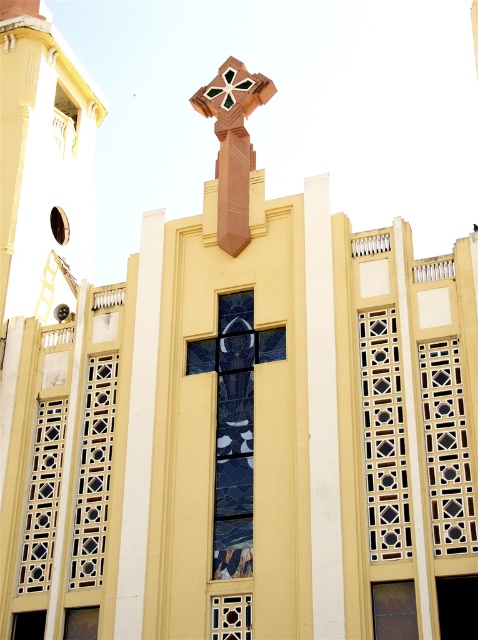
Question: Does stained glass window at center appear on the right side of matte brown window at lower left?

Choices:
 (A) no
 (B) yes

Answer: (B)

Question: Is translucent glass window at left positioned in front of matte white window at upper left?

Choices:
 (A) no
 (B) yes

Answer: (B)

Question: Which point appears closest to the camera in this image?

Choices:
 (A) (67, 269)
 (B) (228, 90)
 (C) (441, 508)
 (D) (22, 580)

Answer: (C)

Question: Can you confirm if translucent glass lattice at left is positioned to the right of matte brown window at lower left?

Choices:
 (A) yes
 (B) no

Answer: (B)

Question: Which object appears closest to the camera in this image?

Choices:
 (A) translucent glass window at left
 (B) clear glass window at lower right
 (C) matte white window at upper left

Answer: (B)

Question: Which of the following is the farthest from the observer?

Choices:
 (A) translucent glass lattice at center-right
 (B) clear glass window at lower right

Answer: (A)